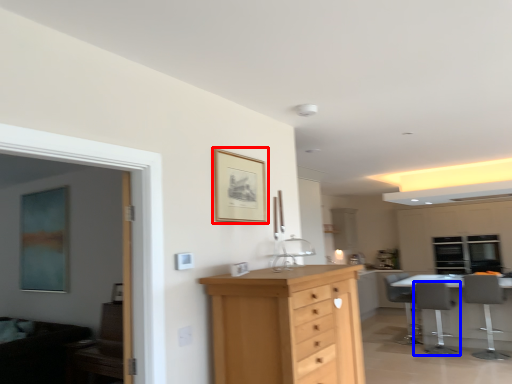
Question: Which object appears farthest to the camera in this image, picture frame (highlighted by a red box) or chair (highlighted by a blue box)?

Choices:
 (A) picture frame
 (B) chair

Answer: (B)